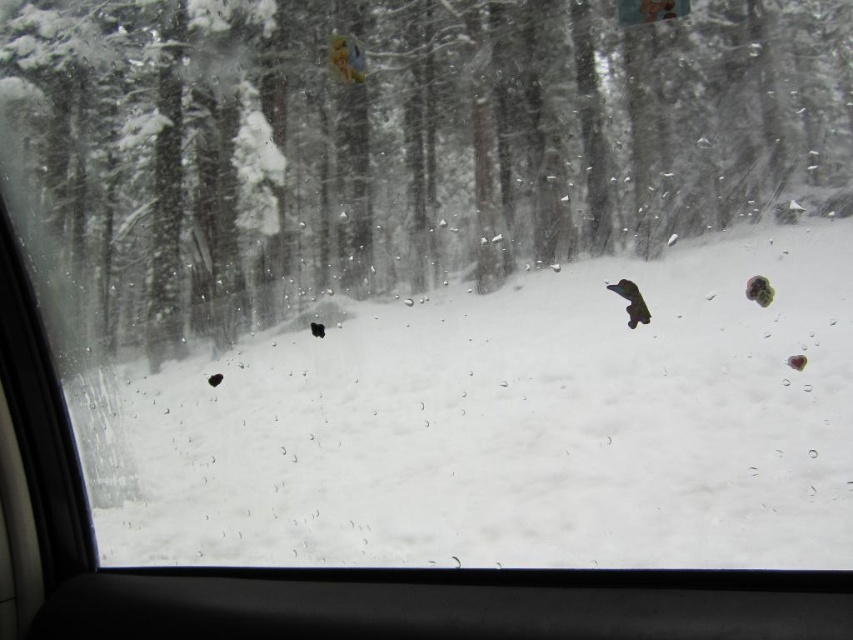
Question: Is snowy bark tree at center closer to camera compared to green fuzzy animal at right?

Choices:
 (A) yes
 (B) no

Answer: (A)

Question: Does snowy bark tree at center appear under black matte dog at center?

Choices:
 (A) no
 (B) yes

Answer: (A)

Question: Which object is positioned farthest from the green fuzzy animal at right?

Choices:
 (A) snowy bark tree at center
 (B) black matte dog at center
 (C) white matte snow at center

Answer: (A)

Question: Which of the following is the closest to the observer?

Choices:
 (A) green fuzzy animal at right
 (B) black matte dog at center
 (C) white matte snow at center

Answer: (C)

Question: Which object appears farthest from the camera in this image?

Choices:
 (A) snowy bark tree at center
 (B) white matte snow at center
 (C) black matte dog at center

Answer: (C)

Question: Is white matte snow at center to the right of green fuzzy animal at right from the viewer's perspective?

Choices:
 (A) yes
 (B) no

Answer: (B)